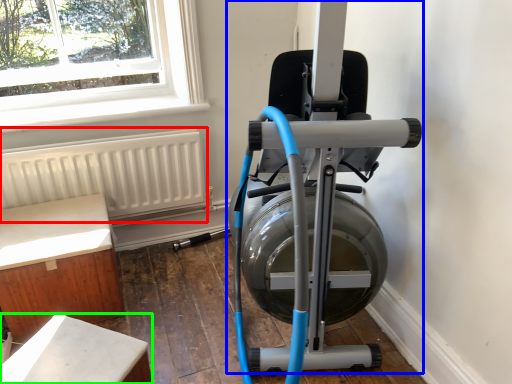
Question: Which object is the closest to the radiator (highlighted by a red box)? Choose among these: stationary bicycle (highlighted by a blue box) or furniture (highlighted by a green box).

Choices:
 (A) stationary bicycle
 (B) furniture

Answer: (A)